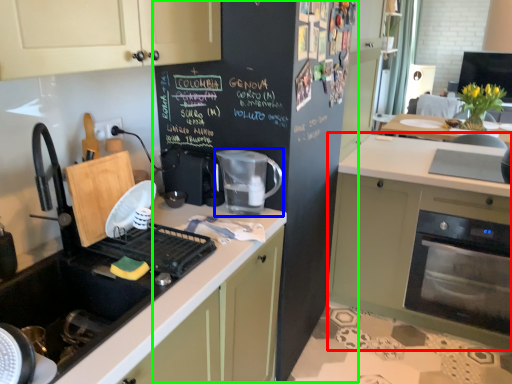
Question: Which is farther away from cabinetry (highlighted by a red box)? kitchen appliance (highlighted by a blue box) or bulletin board (highlighted by a green box)?

Choices:
 (A) kitchen appliance
 (B) bulletin board

Answer: (A)